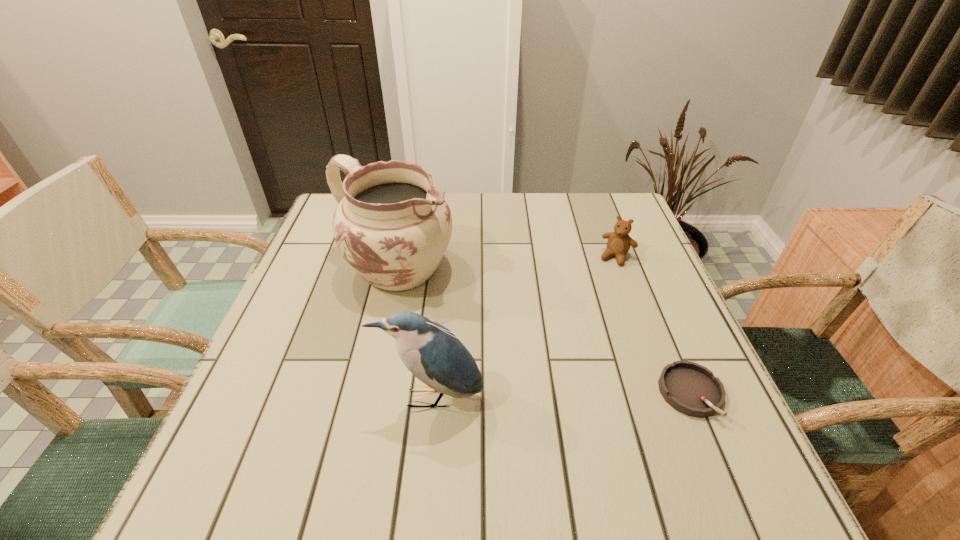
Identify the location of free space located 0.220m on the front-facing side of the teddy bear. (582, 321).

Image resolution: width=960 pixels, height=540 pixels. Identify the location of free space located 0.330m on the front-facing side of the teddy bear. (564, 354).

You are a GUI agent. You are given a task and a screenshot of the screen. Output one action in this format:
    pyautogui.click(x=<x>, y=<y>)
    Task: Click on the object present at the far edge
    
    Given the screenshot: What is the action you would take?
    pyautogui.click(x=392, y=226)

Where is `bird that is at the near edge`? The image size is (960, 540). bird that is at the near edge is located at coordinates (432, 353).

The width and height of the screenshot is (960, 540). What are the coordinates of `ashtray present at the near edge` in the screenshot? It's located at (690, 388).

The image size is (960, 540). In order to click on object located at the left edge in this screenshot , I will do `click(392, 226)`.

Identify the location of ashtray at the right edge. This screenshot has width=960, height=540. (690, 388).

The width and height of the screenshot is (960, 540). I want to click on teddy bear positioned at the right edge, so click(x=619, y=242).

At what (x,y) coordinates should I click in order to perform the action: click on object located in the far left corner section of the desktop. Please return your answer as a coordinate pair (x, y). Looking at the image, I should click on [392, 226].

Identify the location of object located at the near right corner. The width and height of the screenshot is (960, 540). (690, 388).